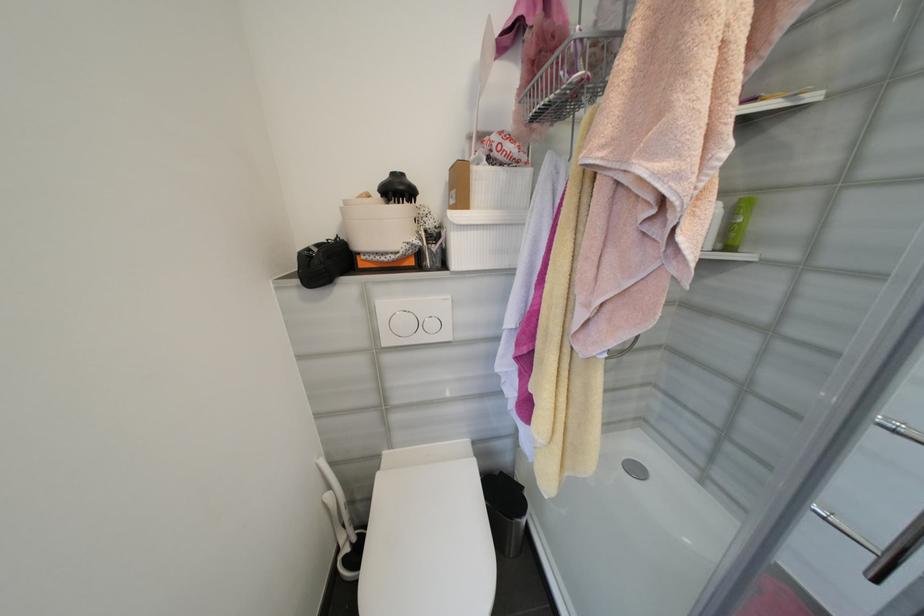
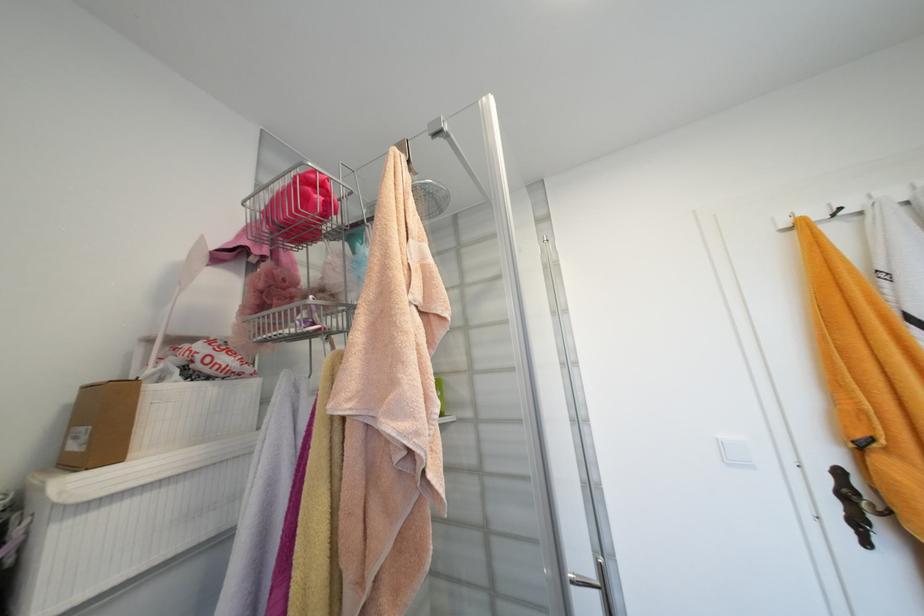
The point at (560, 37) is marked in the first image. Where is the corresponding point in the second image?

(289, 282)